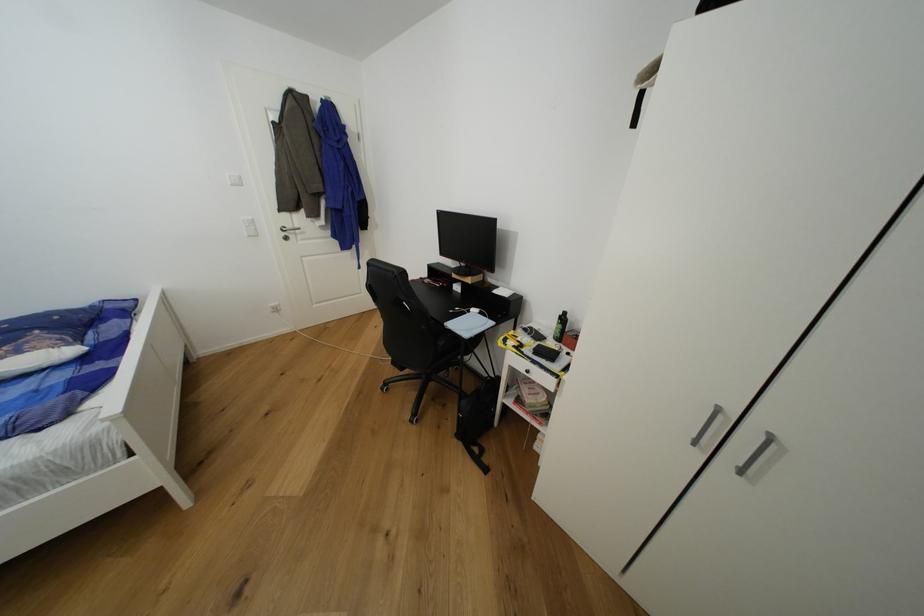
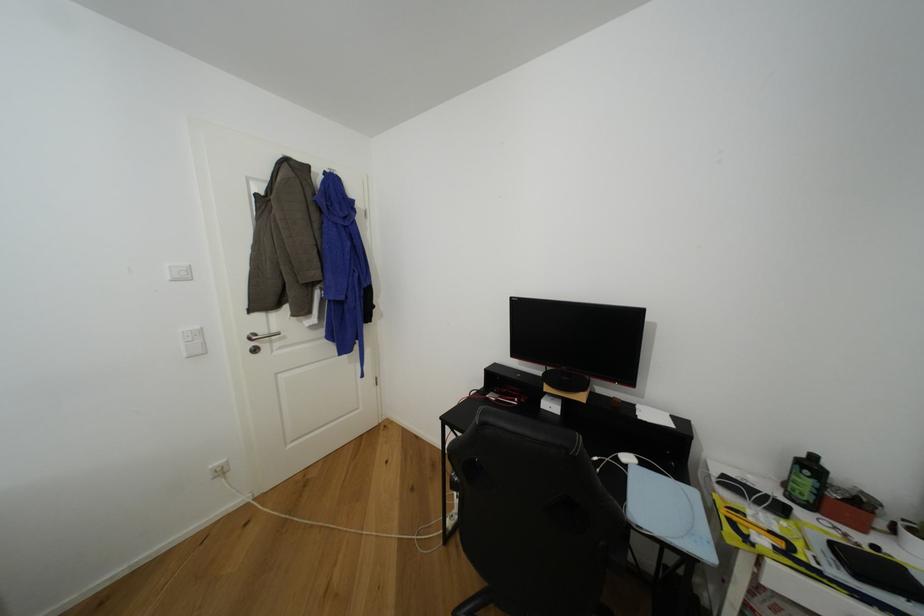
In the second image, find the point that corresponds to point (295, 228) in the first image.

(268, 334)